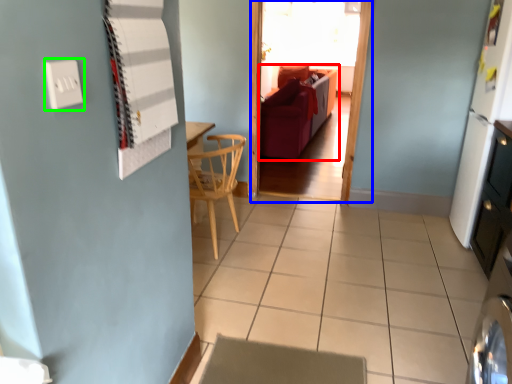
Question: Based on their relative distances, which object is farther from studio couch (highlighted by a red box)? Choose from glass door (highlighted by a blue box) and electric outlet (highlighted by a green box).

Choices:
 (A) glass door
 (B) electric outlet

Answer: (B)